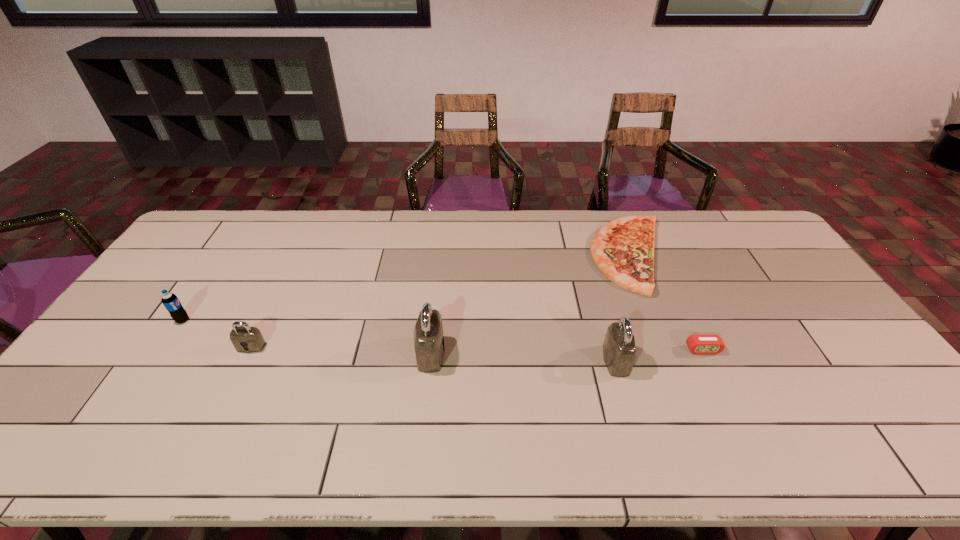
The image size is (960, 540). In the image, there is a desktop. In order to click on free space at the near right corner in this screenshot , I will do `click(889, 393)`.

Locate an element on the screen. vacant space in between the alarm clock and the rightmost padlock is located at coordinates (660, 355).

Where is `vacant space in between the second padlock from right to left and the leftmost object`? The image size is (960, 540). vacant space in between the second padlock from right to left and the leftmost object is located at coordinates (307, 337).

Locate an element on the screen. This screenshot has width=960, height=540. blank region between the second padlock from right to left and the alarm clock is located at coordinates (566, 352).

This screenshot has height=540, width=960. In order to click on free point between the second padlock from right to left and the leftmost padlock in this screenshot , I will do `click(341, 350)`.

Where is `empty location between the rightmost padlock and the alarm clock`? This screenshot has height=540, width=960. empty location between the rightmost padlock and the alarm clock is located at coordinates (660, 355).

The image size is (960, 540). Find the location of `free space between the fourth object from right to left and the farthest object`. free space between the fourth object from right to left and the farthest object is located at coordinates (531, 304).

This screenshot has width=960, height=540. In order to click on empty space that is in between the soda bottle and the leftmost padlock in this screenshot , I will do `click(217, 333)`.

Locate an element on the screen. The width and height of the screenshot is (960, 540). vacant point located between the leftmost object and the farthest object is located at coordinates (407, 288).

Where is `empty space that is in between the second object from left to right and the third object from left to right`? empty space that is in between the second object from left to right and the third object from left to right is located at coordinates (341, 350).